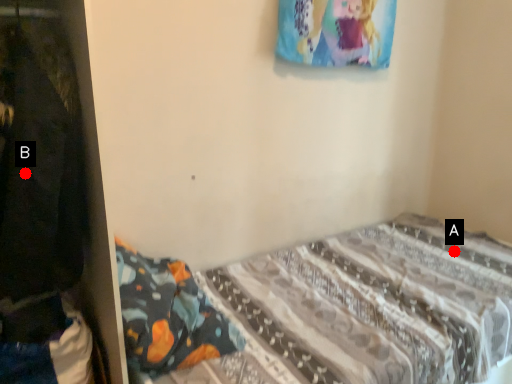
Question: Two points are circled on the image, labeled by A and B beside each circle. Which point appears farthest from the camera in this image?

Choices:
 (A) A is further
 (B) B is further

Answer: (A)